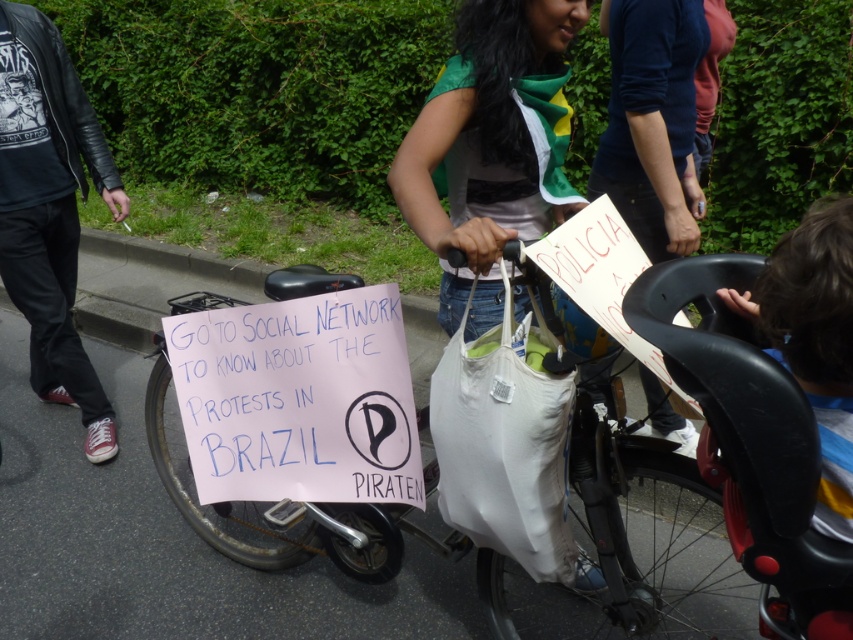
Question: Which object is closer to the camera taking this photo?

Choices:
 (A) green fabric scarf at center
 (B) black leather jacket at left

Answer: (A)

Question: Which of the following is the farthest from the observer?

Choices:
 (A) pink paper sign at center
 (B) green fabric scarf at center
 (C) white fabric bag at center

Answer: (B)

Question: Estimate the real-world distances between objects in this image. Which object is farther from the green fabric scarf at center?

Choices:
 (A) pink paper sign at center
 (B) black leather jacket at left

Answer: (B)

Question: Observing the image, what is the correct spatial positioning of pink paper sign at center in reference to green fabric scarf at center?

Choices:
 (A) left
 (B) right

Answer: (A)

Question: Is green fabric scarf at center positioned in front of white fabric bag at center?

Choices:
 (A) yes
 (B) no

Answer: (B)

Question: Does pink paper sign at center appear over black leather jacket at left?

Choices:
 (A) yes
 (B) no

Answer: (B)